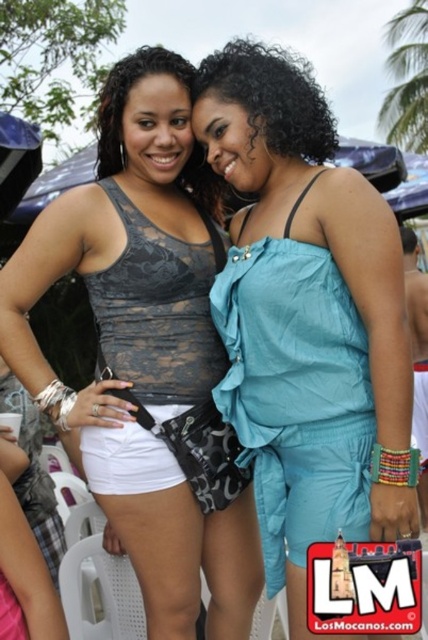
Is point (389, 396) less distant than point (17, 317)?

Yes, it is.

Is teal satin jumpsuit at center positioned at the back of matte black tank top at center?

That is False.

Locate an element on the screen. The image size is (428, 640). teal satin jumpsuit at center is located at coordinates (306, 321).